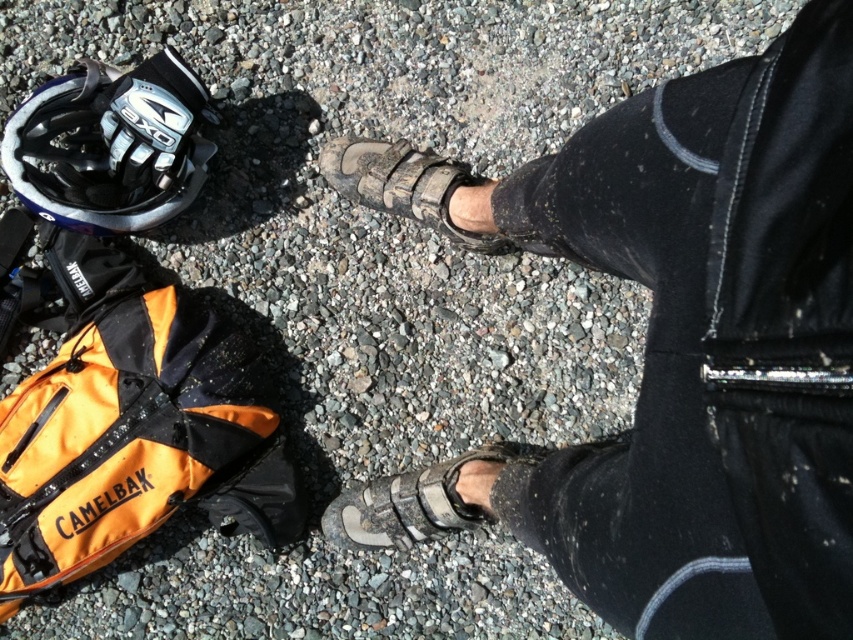
Question: Which of the following is the closest to the observer?

Choices:
 (A) (689, 561)
 (B) (717, 634)
 (C) (416, 200)

Answer: (B)

Question: Is gray suede sandal at lower center below gray suede sandal at center?

Choices:
 (A) yes
 (B) no

Answer: (A)

Question: Which point is farther from the camera taking this photo?

Choices:
 (A) (416, 468)
 (B) (802, 355)
 (C) (643, 624)
 (D) (381, 141)

Answer: (D)

Question: Which is nearer to the leather sandals at center?

Choices:
 (A) gray suede sandal at center
 (B) black fabric strap at lower right
 (C) matte black helmet at upper left

Answer: (A)

Question: Is leather sandals at center to the left of black fabric strap at lower right from the viewer's perspective?

Choices:
 (A) yes
 (B) no

Answer: (A)

Question: Is gray suede sandal at center in front of black fabric strap at lower right?

Choices:
 (A) no
 (B) yes

Answer: (A)